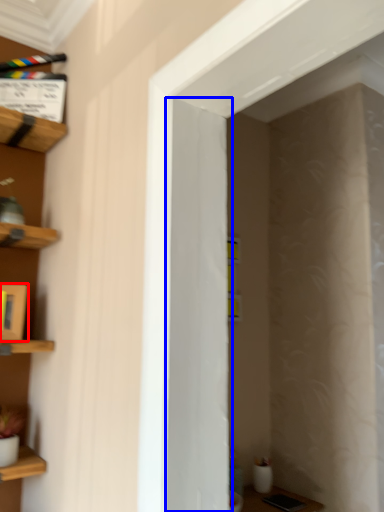
Question: Among these objects, which one is farthest to the camera, cabinet (highlighted by a red box) or door (highlighted by a blue box)?

Choices:
 (A) cabinet
 (B) door

Answer: (A)